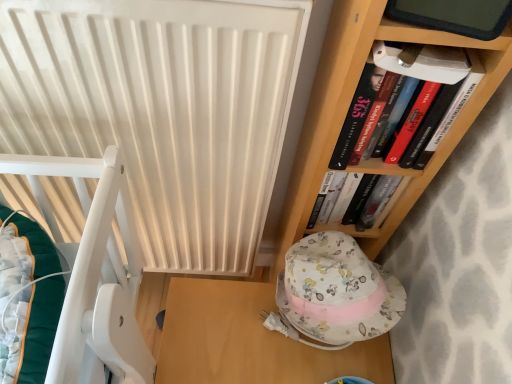
Where is `empty space that is ontop of wooden table at lower center (from a real-world perspective)`? empty space that is ontop of wooden table at lower center (from a real-world perspective) is located at coordinates (252, 335).